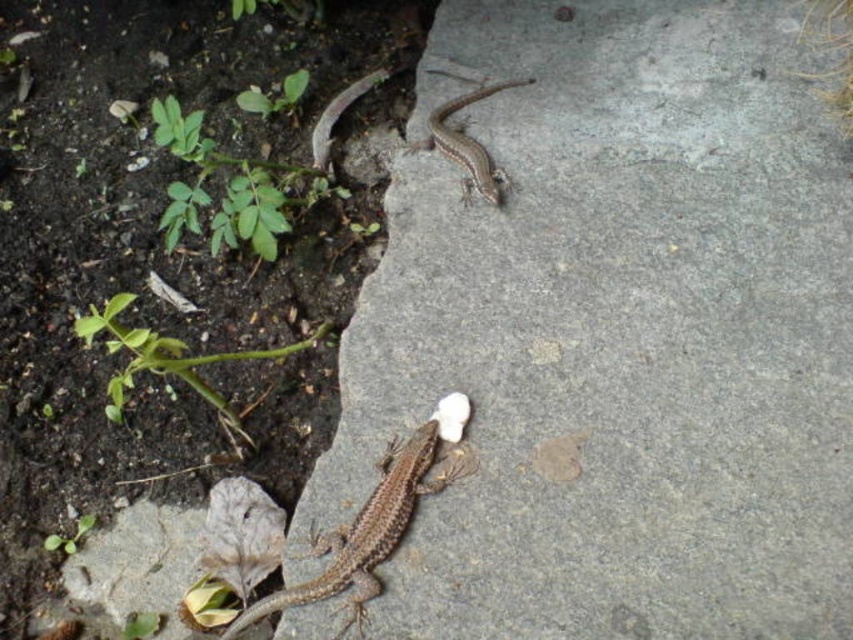
You are a wildlife photographer aiming to capture both lizards in a single shot. Given that your camera has a focal length that can cover a maximum distance of 25 inches between subjects, will you be able to include both the brown scaly lizard at center and the brown scaly lizard at upper center in the frame?

The distance between the brown scaly lizard at center and the brown scaly lizard at upper center is 24.70 inches, which is just under the camera lens maximum coverage of 25 inches. Therefore, you can include both lizards in the frame.

Consider the image. You are standing 4 feet away from a brown scaly lizard at center. Can you reach it with a 3.5 feet long stick?

The brown scaly lizard at center is 3.97 feet away from you, so a 3.5 feet long stick would not be sufficient to reach it.

You are a small insect trying to cross from one end of the smooth concrete stone at center to the other. There is a brown scaly lizard at center on the stone. Considering their sizes, do you think the lizard will block your entire path?

The smooth concrete stone at center is bigger than the brown scaly lizard at center, so the lizard will not block your entire path since it is smaller than the stone.